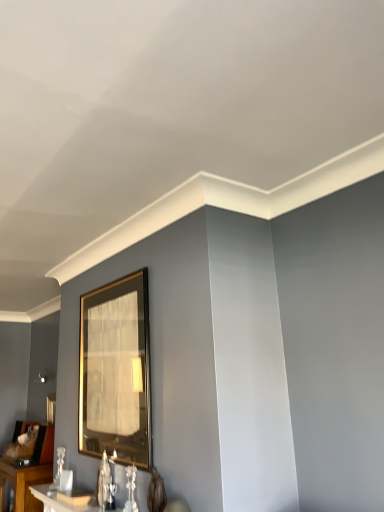
Question: Should I look upward or downward to see gold metallic picture frame at center, which ranks as the 1th picture frame in right-to-left order?

Choices:
 (A) down
 (B) up

Answer: (A)

Question: Could white glossy table at lower left, placed as the 2th table when sorted from bottom to top, be considered to be inside gold-framed mirror at lower left, which is the second picture frame in top-to-bottom order?

Choices:
 (A) no
 (B) yes

Answer: (A)

Question: Considering the relative positions of gold-framed mirror at lower left, marked as the first picture frame in a left-to-right arrangement, and white glossy table at lower left, which is the second table from back to front, in the image provided, is gold-framed mirror at lower left, marked as the first picture frame in a left-to-right arrangement, behind white glossy table at lower left, which is the second table from back to front,?

Choices:
 (A) yes
 (B) no

Answer: (A)

Question: Can we say gold-framed mirror at lower left, the 2th picture frame when ordered from front to back, lies outside white glossy table at lower left, the second table from the left?

Choices:
 (A) no
 (B) yes

Answer: (B)

Question: Is there a large distance between gold-framed mirror at lower left, which ranks as the first picture frame in bottom-to-top order, and white glossy table at lower left, marked as the 1th table in a top-to-bottom arrangement?

Choices:
 (A) yes
 (B) no

Answer: (A)

Question: From the image's perspective, does gold-framed mirror at lower left, which ranks as the first picture frame in bottom-to-top order, appear higher than white glossy table at lower left, marked as the 1th table in a top-to-bottom arrangement?

Choices:
 (A) no
 (B) yes

Answer: (A)

Question: From the image's perspective, is gold-framed mirror at lower left, marked as the first picture frame in a left-to-right arrangement, beneath white glossy table at lower left, which is the second table from back to front?

Choices:
 (A) no
 (B) yes

Answer: (B)

Question: From a real-world perspective, is gold metallic picture frame at center, arranged as the first picture frame when viewed from the front, beneath gold-framed mirror at lower left, which ranks as the first picture frame in bottom-to-top order?

Choices:
 (A) no
 (B) yes

Answer: (A)

Question: Can you confirm if gold metallic picture frame at center, the second picture frame in the bottom-to-top sequence, is thinner than gold-framed mirror at lower left, marked as the first picture frame in a left-to-right arrangement?

Choices:
 (A) yes
 (B) no

Answer: (A)

Question: Is gold metallic picture frame at center, the second picture frame in the bottom-to-top sequence, wider than gold-framed mirror at lower left, the 2th picture frame when ordered from front to back?

Choices:
 (A) yes
 (B) no

Answer: (B)

Question: Is gold metallic picture frame at center, arranged as the first picture frame when viewed from the front, at the left side of gold-framed mirror at lower left, arranged as the second picture frame when viewed from the right?

Choices:
 (A) yes
 (B) no

Answer: (B)

Question: Is gold metallic picture frame at center, arranged as the first picture frame when viewed from the front, placed right next to gold-framed mirror at lower left, which ranks as the first picture frame in bottom-to-top order?

Choices:
 (A) yes
 (B) no

Answer: (B)

Question: Can you confirm if gold metallic picture frame at center, which ranks as the 1th picture frame in right-to-left order, is shorter than gold-framed mirror at lower left, which is the second picture frame in top-to-bottom order?

Choices:
 (A) no
 (B) yes

Answer: (A)

Question: From the image's perspective, would you say gold metallic picture frame at center, which ranks as the 1th picture frame in right-to-left order, is shown under white glossy table at lower left, the first table when ordered from back to front?

Choices:
 (A) yes
 (B) no

Answer: (B)